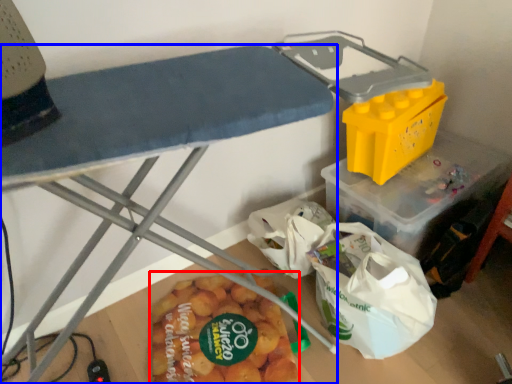
Question: Which object is further to the camera taking this photo, food (highlighted by a red box) or furniture (highlighted by a blue box)?

Choices:
 (A) food
 (B) furniture

Answer: (A)